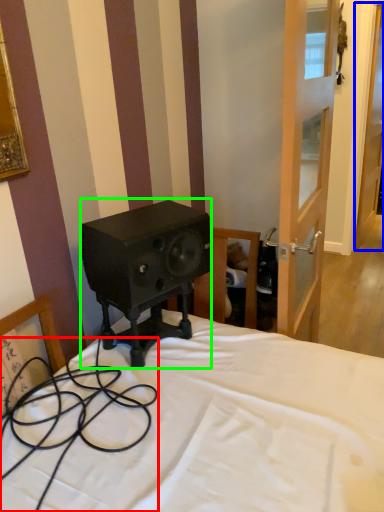
Question: Based on their relative distances, which object is nearer to cable (highlighted by a red box)? Choose from door (highlighted by a blue box) and loudspeaker (highlighted by a green box).

Choices:
 (A) door
 (B) loudspeaker

Answer: (B)